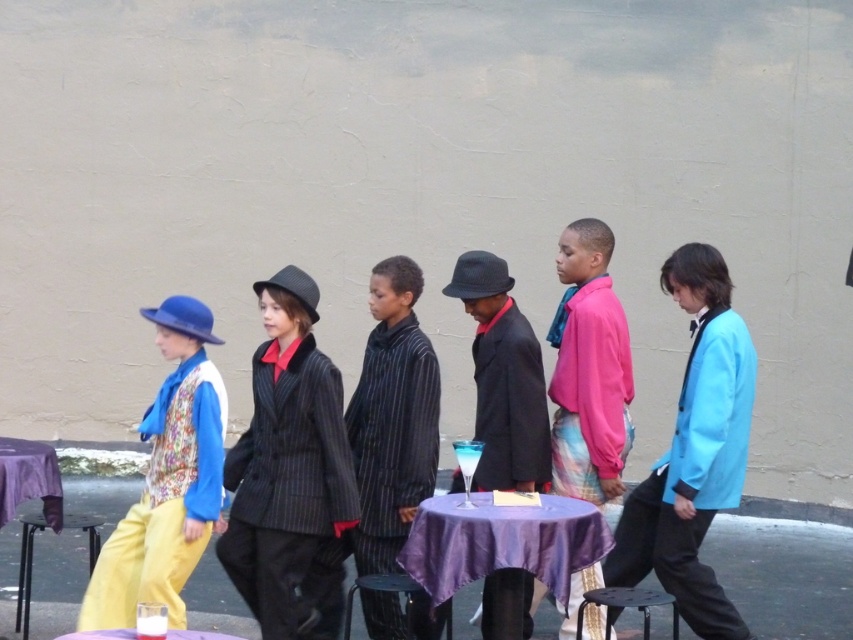
You are a photographer setting up for a group photo. You have a metallic stool at lower left and a purple fabric table at center. Which object should you place your camera on to get a better view of the entire group?

The metallic stool at lower left is much taller than the purple fabric table at center, so placing the camera on the metallic stool at lower left would provide a better view of the entire group.

You are standing in front of the group of six individuals walking against the beige wall. You notice two points marked at coordinates point (83, 529) and point (218, 637). Which of these points is closer to you?

Point (83, 529) is closer to you because it is further to the viewer than point (218, 637).

Based on the photo, you are standing in front of a beige wall where a group of people are walking in a line. You see a striped fabric suit at center and a purple satin table at center. Which object is higher in position?

The striped fabric suit at center is above the purple satin table at center, so the striped fabric suit at center is higher in position.